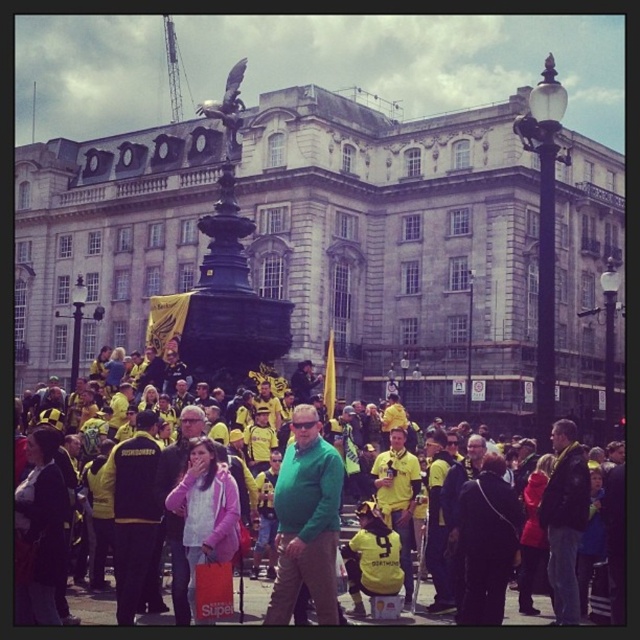
Question: Which of the following is the farthest from the observer?

Choices:
 (A) pink fabric jacket at center
 (B) yellow jersey at center
 (C) green matte shirt at center
 (D) stone statue at center

Answer: (D)

Question: Which point appears closest to the camera in this image?

Choices:
 (A) [72, 586]
 (B) [106, 257]
 (C) [323, 547]

Answer: (C)

Question: Can you confirm if dark blue leather jacket at lower right is positioned below yellow jersey at center?

Choices:
 (A) no
 (B) yes

Answer: (B)

Question: Which point is closer to the camera?

Choices:
 (A) (422, 588)
 (B) (298, 460)

Answer: (B)

Question: Is green matte shirt at center wider than yellow jersey at center?

Choices:
 (A) no
 (B) yes

Answer: (A)

Question: Is dark blue leather jacket at lower right wider than yellow jersey at center?

Choices:
 (A) yes
 (B) no

Answer: (B)